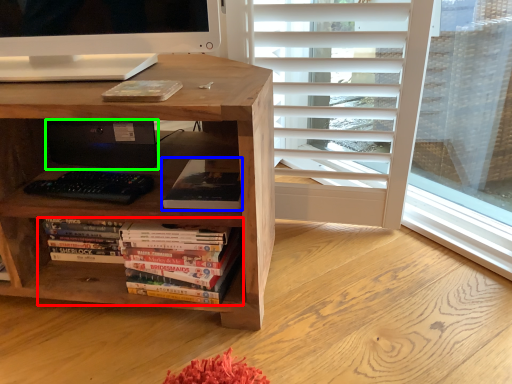
Question: Which object is the farthest from book (highlighted by a red box)? Choose among these: book (highlighted by a blue box) or computer (highlighted by a green box).

Choices:
 (A) book
 (B) computer

Answer: (B)